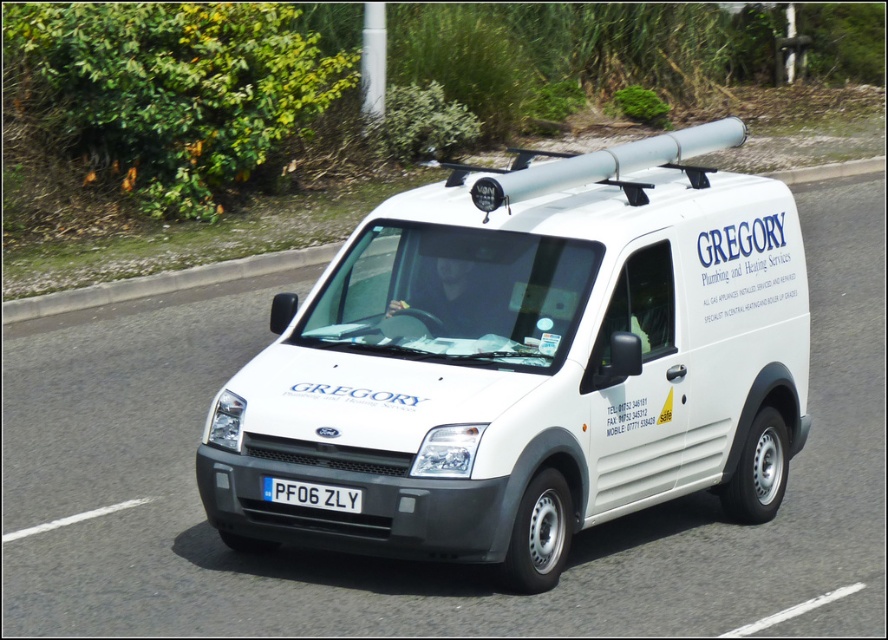
Question: Which of the following is the closest to the observer?

Choices:
 (A) white plastic license plate at center
 (B) white concrete curb at center
 (C) white matte van at center

Answer: (C)

Question: Estimate the real-world distances between objects in this image. Which object is farther from the white concrete curb at center?

Choices:
 (A) white plastic license plate at center
 (B) white matte van at center

Answer: (A)

Question: Does white matte van at center have a smaller size compared to white plastic license plate at center?

Choices:
 (A) yes
 (B) no

Answer: (B)

Question: Which is farther from the white matte van at center?

Choices:
 (A) white concrete curb at center
 (B) white plastic license plate at center

Answer: (A)

Question: Observing the image, what is the correct spatial positioning of white matte van at center in reference to white concrete curb at center?

Choices:
 (A) below
 (B) above

Answer: (A)

Question: Does white matte van at center lie behind white plastic license plate at center?

Choices:
 (A) yes
 (B) no

Answer: (B)